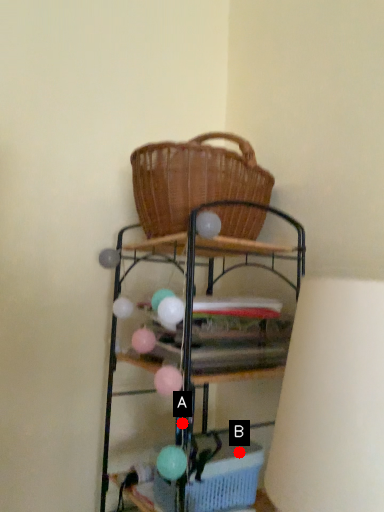
Question: Two points are circled on the image, labeled by A and B beside each circle. Which of the following is the closest to the observer?

Choices:
 (A) A is closer
 (B) B is closer

Answer: (A)